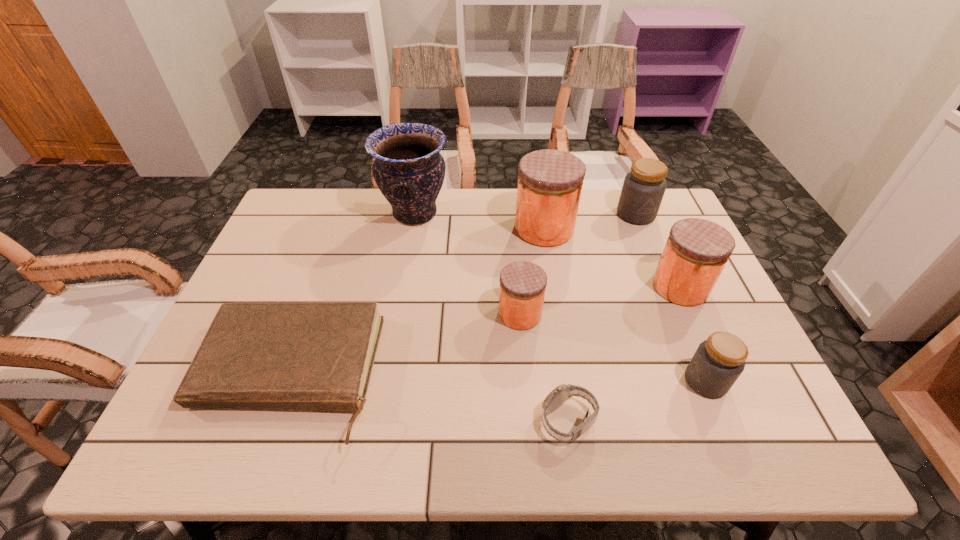
Identify the location of pottery. Image resolution: width=960 pixels, height=540 pixels. (409, 170).

This screenshot has height=540, width=960. In order to click on the biggest orange jar in this screenshot , I will do `click(550, 182)`.

Image resolution: width=960 pixels, height=540 pixels. In order to click on the tallest jar in this screenshot , I will do `click(550, 182)`.

Locate an element on the screen. This screenshot has width=960, height=540. the farther gray jar is located at coordinates (643, 189).

This screenshot has height=540, width=960. I want to click on the second smallest orange jar, so click(x=697, y=250).

Where is `the smallest orange jar`? the smallest orange jar is located at coordinates (522, 288).

Locate an element on the screen. Image resolution: width=960 pixels, height=540 pixels. the nearest jar is located at coordinates (717, 363).

This screenshot has height=540, width=960. I want to click on the smaller gray jar, so click(x=717, y=363).

Where is `watch`? This screenshot has height=540, width=960. watch is located at coordinates (563, 392).

Where is `white watch`? Image resolution: width=960 pixels, height=540 pixels. white watch is located at coordinates (563, 392).